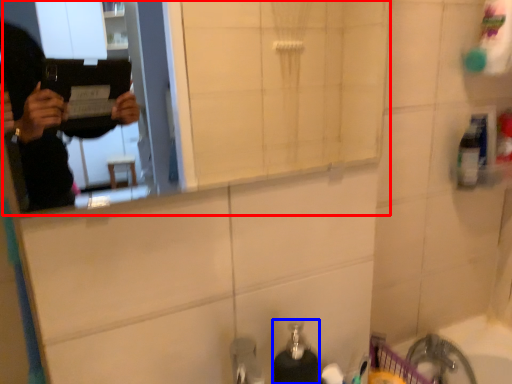
Question: Which object is closer to the camera taking this photo, mirror (highlighted by a red box) or soap dispenser (highlighted by a blue box)?

Choices:
 (A) mirror
 (B) soap dispenser

Answer: (A)